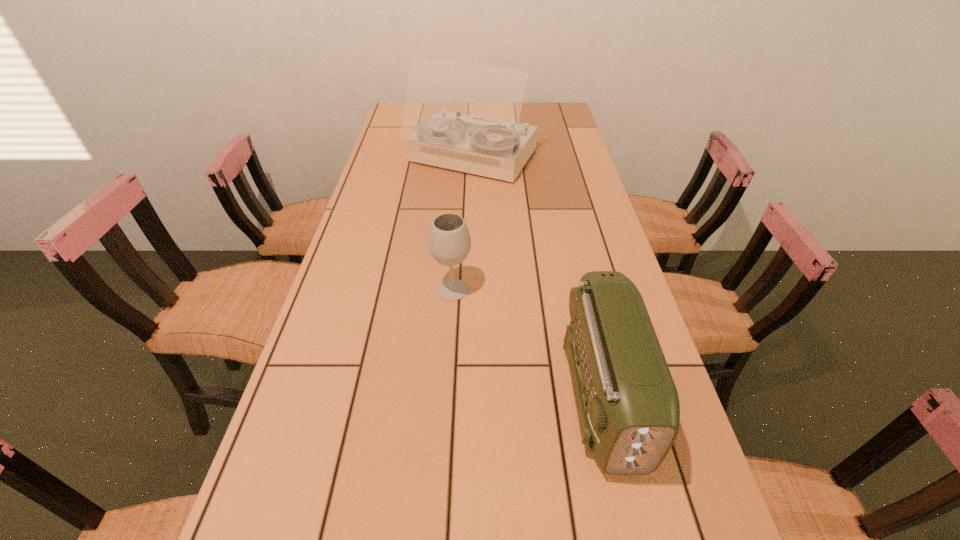
Find the location of a particular element. The image size is (960, 540). vacant region at the right edge of the desktop is located at coordinates (542, 131).

Where is `free space at the far right corner`? The image size is (960, 540). free space at the far right corner is located at coordinates (561, 125).

At what (x,y) coordinates should I click in order to perform the action: click on vacant space that is in between the farthest object and the radio_receiver. Please return your answer as a coordinate pair (x, y). The width and height of the screenshot is (960, 540). Looking at the image, I should click on (538, 278).

Identify the location of free area in between the nearest object and the tallest object. This screenshot has height=540, width=960. (538, 278).

Identify the location of free spot between the radio_receiver and the tallest object. This screenshot has height=540, width=960. (538, 278).

Find the location of a particular element. This screenshot has height=540, width=960. object that is the closest to the tallest object is located at coordinates (449, 243).

At what (x,y) coordinates should I click in order to perform the action: click on object that is the second nearest to the radio_receiver. Please return your answer as a coordinate pair (x, y). This screenshot has height=540, width=960. Looking at the image, I should click on (459, 115).